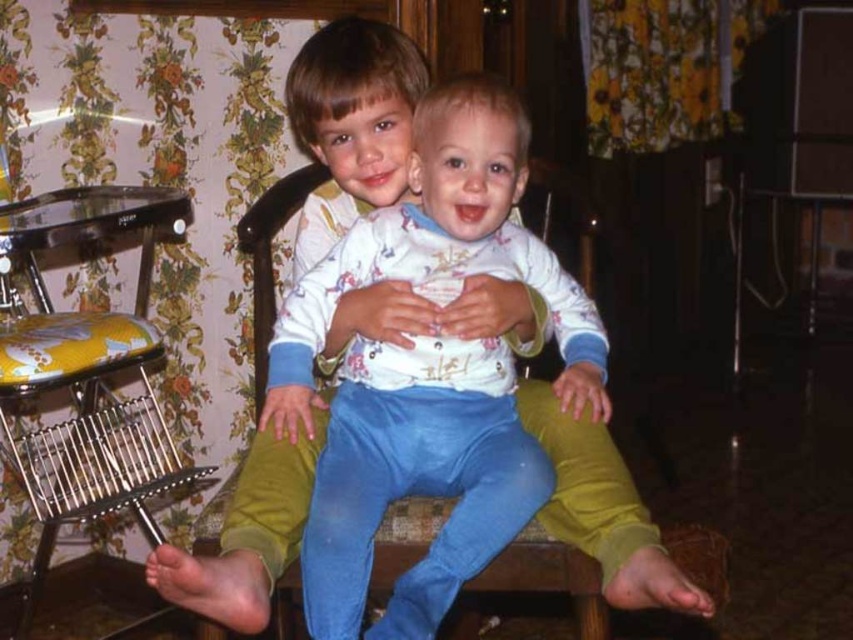
Between white cotton shirt at center and yellow fabric rocking chair at left, which one appears on the right side from the viewer's perspective?

Positioned to the right is white cotton shirt at center.

Is point (390, 384) positioned before point (136, 336)?

Yes, it is in front of point (136, 336).

Is point (498, 112) positioned before point (41, 538)?

Yes, it is.

At what (x,y) coordinates should I click in order to perform the action: click on white cotton shirt at center. Please return your answer as a coordinate pair (x, y). The height and width of the screenshot is (640, 853). Looking at the image, I should click on (416, 480).